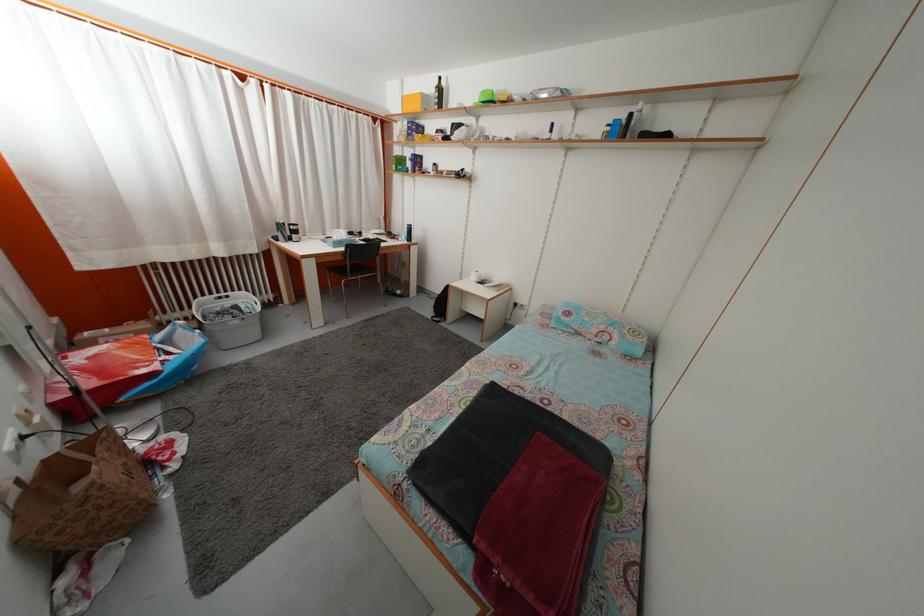
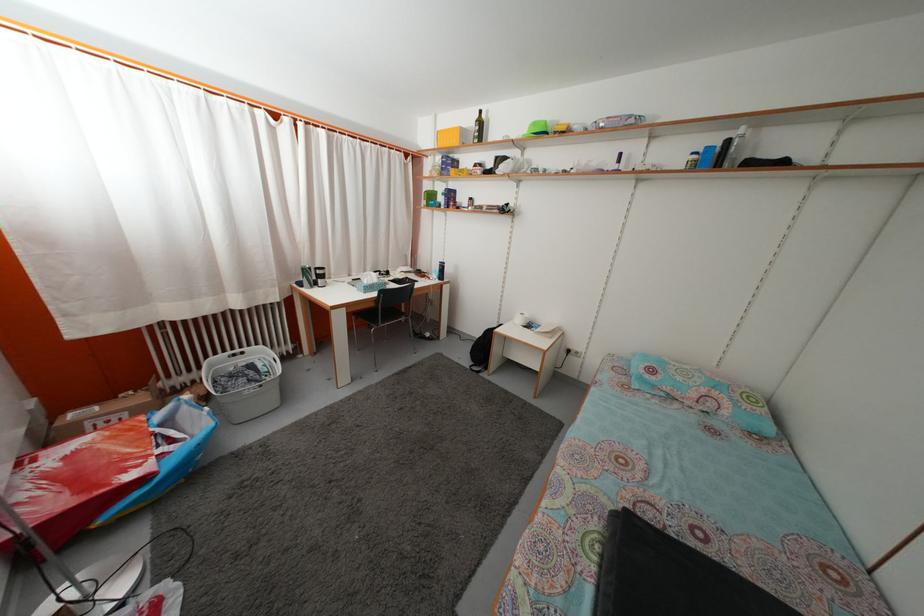
The images are taken continuously from a first-person perspective. In which direction are you moving?

The movement direction of the cameraman is left, forward.